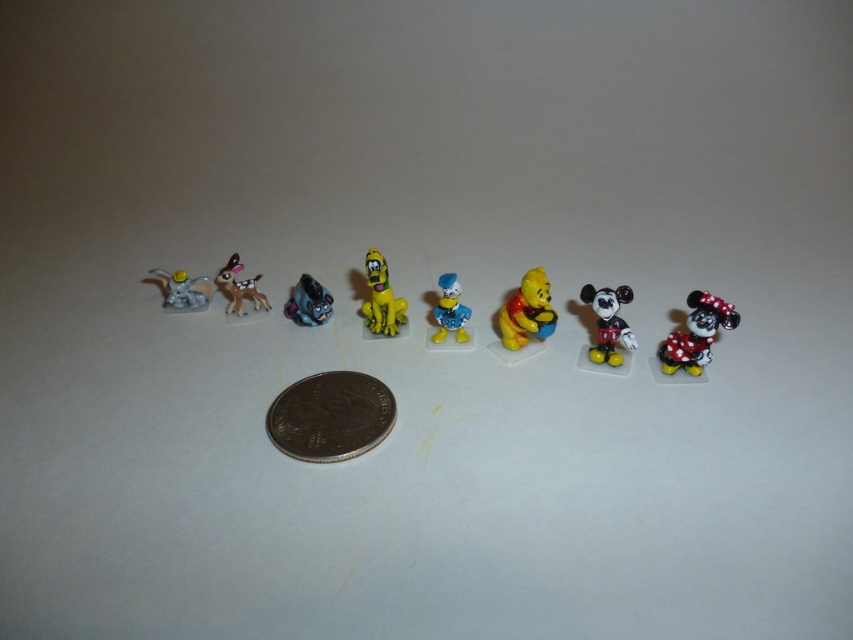
Is bronze metallic coin at center bigger than metallic blue robot at center?

Indeed, bronze metallic coin at center has a larger size compared to metallic blue robot at center.

Which of these two, bronze metallic coin at center or metallic blue robot at center, stands shorter?

With less height is metallic blue robot at center.

Find the location of a particular element. The image size is (853, 640). bronze metallic coin at center is located at coordinates (329, 417).

Can you confirm if bronze metallic coin at center is positioned to the left of yellow matte winnie the pooh at center?

Indeed, bronze metallic coin at center is positioned on the left side of yellow matte winnie the pooh at center.

Image resolution: width=853 pixels, height=640 pixels. In order to click on bronze metallic coin at center in this screenshot , I will do `click(329, 417)`.

Find the location of a particular element. bronze metallic coin at center is located at coordinates (329, 417).

Does point (390, 310) come behind point (190, 305)?

No, (390, 310) is in front of (190, 305).

The image size is (853, 640). Find the location of `matte plastic dog at center`. matte plastic dog at center is located at coordinates click(x=381, y=298).